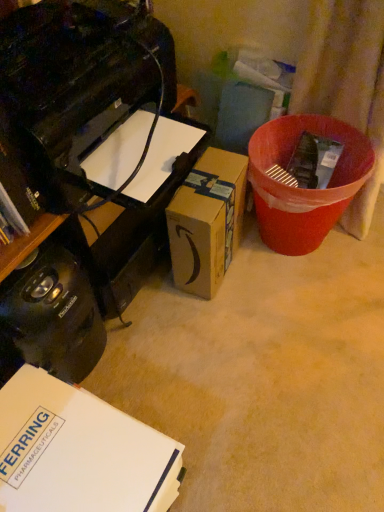
Question: Can you confirm if red plastic bin at right is positioned to the left of black plastic toaster at lower left?

Choices:
 (A) yes
 (B) no

Answer: (B)

Question: Is red plastic bin at right wider than black plastic toaster at lower left?

Choices:
 (A) no
 (B) yes

Answer: (B)

Question: Is black plastic toaster at lower left at the back of red plastic bin at right?

Choices:
 (A) no
 (B) yes

Answer: (A)

Question: Is the surface of red plastic bin at right in direct contact with black plastic toaster at lower left?

Choices:
 (A) yes
 (B) no

Answer: (B)

Question: From a real-world perspective, is red plastic bin at right on black plastic toaster at lower left?

Choices:
 (A) yes
 (B) no

Answer: (B)

Question: Can you confirm if red plastic bin at right is thinner than black plastic toaster at lower left?

Choices:
 (A) no
 (B) yes

Answer: (A)

Question: Considering the relative sizes of brown cardboard box at center, arranged as the 2th box when viewed from the left, and white cardboard box at lower left, the 2th box viewed from the top, in the image provided, is brown cardboard box at center, arranged as the 2th box when viewed from the left, smaller than white cardboard box at lower left, the 2th box viewed from the top,?

Choices:
 (A) yes
 (B) no

Answer: (A)

Question: Would you say brown cardboard box at center, which is the 2th box in front-to-back order, is a long distance from white cardboard box at lower left, arranged as the first box when viewed from the front?

Choices:
 (A) no
 (B) yes

Answer: (A)

Question: Can you confirm if brown cardboard box at center, which is the 2th box in front-to-back order, is bigger than white cardboard box at lower left, placed as the 2th box when sorted from back to front?

Choices:
 (A) no
 (B) yes

Answer: (A)

Question: From the image's perspective, is brown cardboard box at center, arranged as the 2th box when viewed from the left, on top of white cardboard box at lower left, the first box when ordered from left to right?

Choices:
 (A) yes
 (B) no

Answer: (A)

Question: Does brown cardboard box at center, arranged as the 2th box when viewed from the left, have a lesser height compared to white cardboard box at lower left, the 2th box viewed from the top?

Choices:
 (A) yes
 (B) no

Answer: (B)

Question: From a real-world perspective, is brown cardboard box at center, placed as the 2th box when sorted from bottom to top, positioned over white cardboard box at lower left, arranged as the first box when viewed from the front, based on gravity?

Choices:
 (A) yes
 (B) no

Answer: (A)

Question: Is white cardboard box at lower left, placed as the 2th box when sorted from back to front, aimed at black plastic toaster at lower left?

Choices:
 (A) no
 (B) yes

Answer: (A)